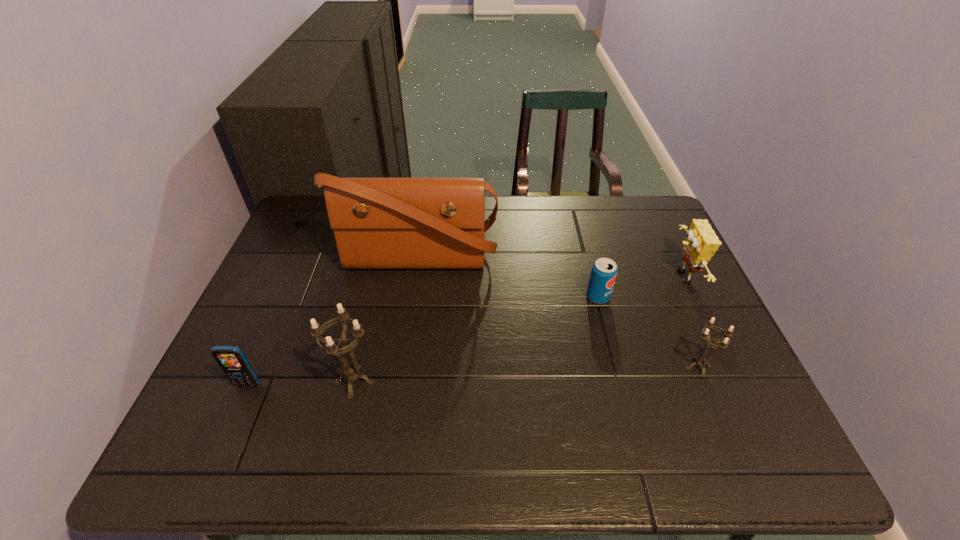
Please point a location where one more candle_holder can be added evenly. Please provide its 2D coordinates. Your answer should be formatted as a tuple, i.e. [(x, y)], where the tuple contains the x and y coordinates of a point satisfying the conditions above.

[(529, 374)]